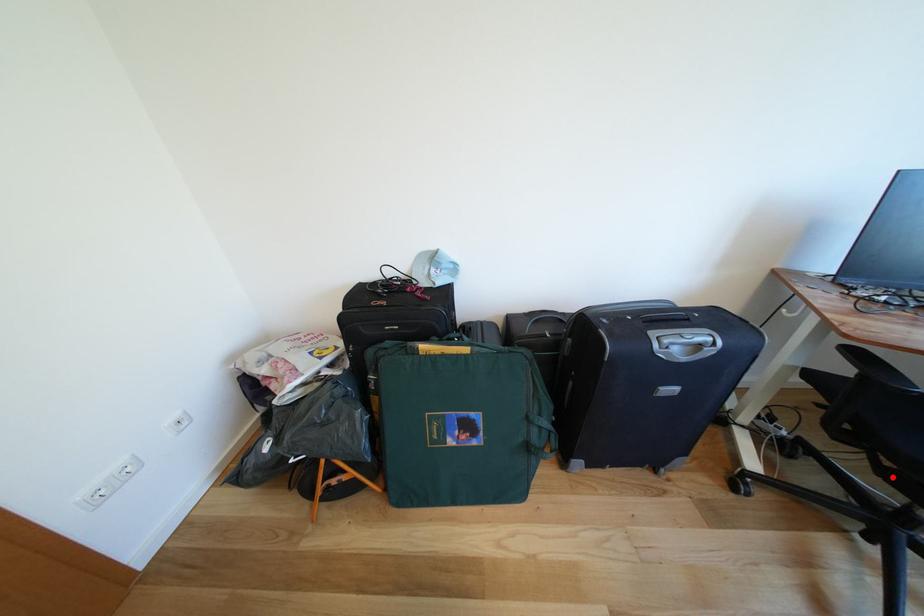
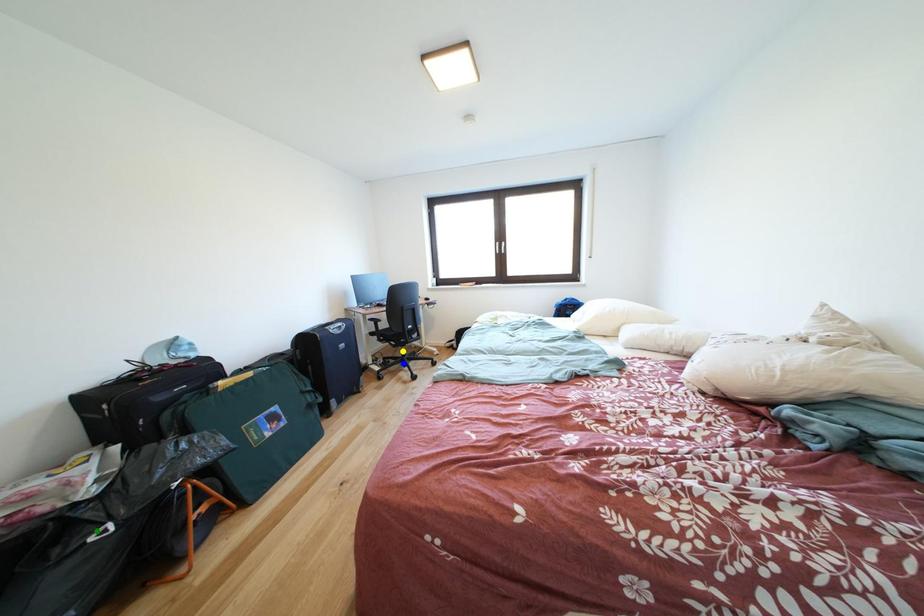
Question: I am providing you with two images of the same scene from different viewpoints. A red point is marked on the first image. You are given multiple points on the second image. Which point in image 2 is actually the same real-world point as the red point in image 1?

Choices:
 (A) yellow point
 (B) green point
 (C) blue point

Answer: (A)